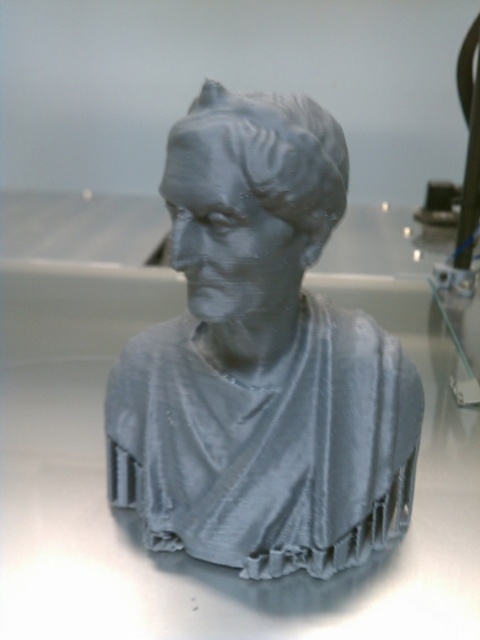
Question: Does gray matte bust at center have a greater width compared to matte gray bust at center?

Choices:
 (A) yes
 (B) no

Answer: (A)

Question: Which of the following is the closest to the observer?

Choices:
 (A) gray matte bust at center
 (B) matte gray bust at center

Answer: (B)

Question: Which object is closer to the camera taking this photo?

Choices:
 (A) gray matte bust at center
 (B) matte gray bust at center

Answer: (B)

Question: Among these objects, which one is nearest to the camera?

Choices:
 (A) matte gray bust at center
 (B) gray matte bust at center

Answer: (A)

Question: Does gray matte bust at center lie in front of matte gray bust at center?

Choices:
 (A) no
 (B) yes

Answer: (A)

Question: Is gray matte bust at center in front of matte gray bust at center?

Choices:
 (A) yes
 (B) no

Answer: (B)